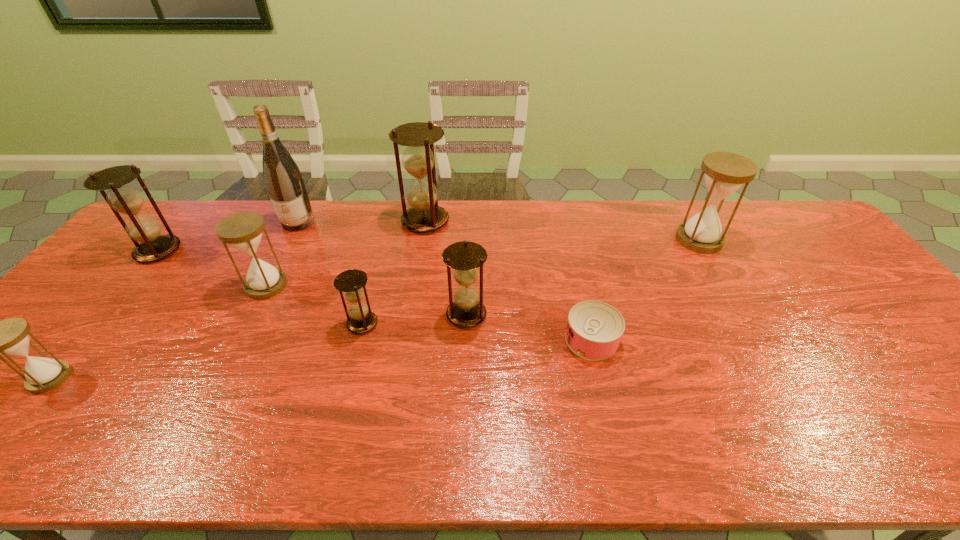
At what (x,y) coordinates should I click in order to perform the action: click on blank space at the near edge. Please return your answer as a coordinate pair (x, y). Looking at the image, I should click on (848, 436).

Locate an element on the screen. vacant space at the right edge of the desktop is located at coordinates (874, 343).

At what (x,y) coordinates should I click in order to perform the action: click on free space between the sixth hourglass from left to right and the farthest white hourglass. Please return your answer as a coordinate pair (x, y). Looking at the image, I should click on (583, 277).

Locate an element on the screen. The width and height of the screenshot is (960, 540). unoccupied position between the second biggest brown hourglass and the smallest white hourglass is located at coordinates (105, 314).

I want to click on free spot between the leftmost brown hourglass and the fourth farthest hourglass, so click(212, 268).

The image size is (960, 540). I want to click on empty space that is in between the second smallest brown hourglass and the can, so click(529, 327).

Locate an element on the screen. vacant space that's between the fourth object from right to left and the shortest object is located at coordinates pos(509,280).

The image size is (960, 540). Find the location of `unoccupied position between the shortest object and the fourth hourglass from left to right`. unoccupied position between the shortest object and the fourth hourglass from left to right is located at coordinates (477, 332).

Where is `vacant point located between the sixth hourglass from left to right and the fifth object from left to right`? The width and height of the screenshot is (960, 540). vacant point located between the sixth hourglass from left to right and the fifth object from left to right is located at coordinates (415, 319).

Locate an element on the screen. This screenshot has height=540, width=960. vacant region between the rightmost hourglass and the third smallest brown hourglass is located at coordinates 428,245.